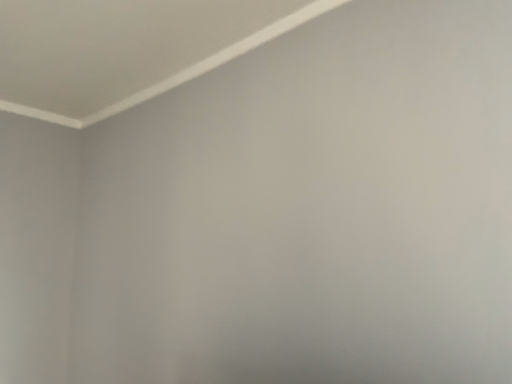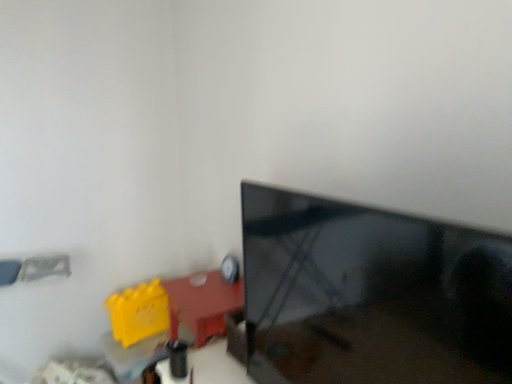
Question: How did the camera likely rotate when shooting the video?

Choices:
 (A) rotated left
 (B) rotated right

Answer: (A)